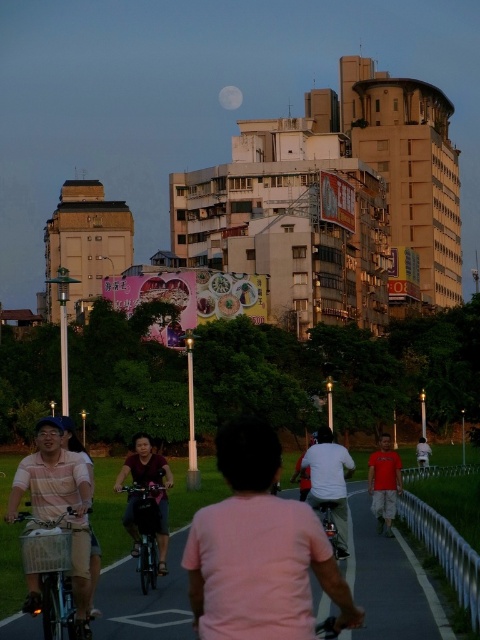
You are standing at the origin point of the scene. A cyclist wearing a white matte shirt at center is located at coordinates point 0.753, 0.685. If you want to move towards the cyclist, in which direction should you head?

The white matte shirt at center is located at coordinates point (328, 481). Since the x and y coordinates are both greater than 0.5, you should move towards the northeast direction to reach the cyclist.

You are a photographer trying to capture a photo of the cyclists in the scene. You notice two cyclists wearing pink fabric shirt at center and white matte shirt at center. Which cyclist should you focus on first if you want to photograph them from left to right?

The pink fabric shirt at center is positioned on the left side of white matte shirt at center, so you should focus on the pink fabric shirt at center first when photographing them from left to right.

You are a photographer standing on the pathway and want to take a photo of the white matte shirt at center and the white cotton shirt at center. Which one is positioned higher in the frame?

The white matte shirt at center is located above the white cotton shirt at center, so it is positioned higher in the frame.